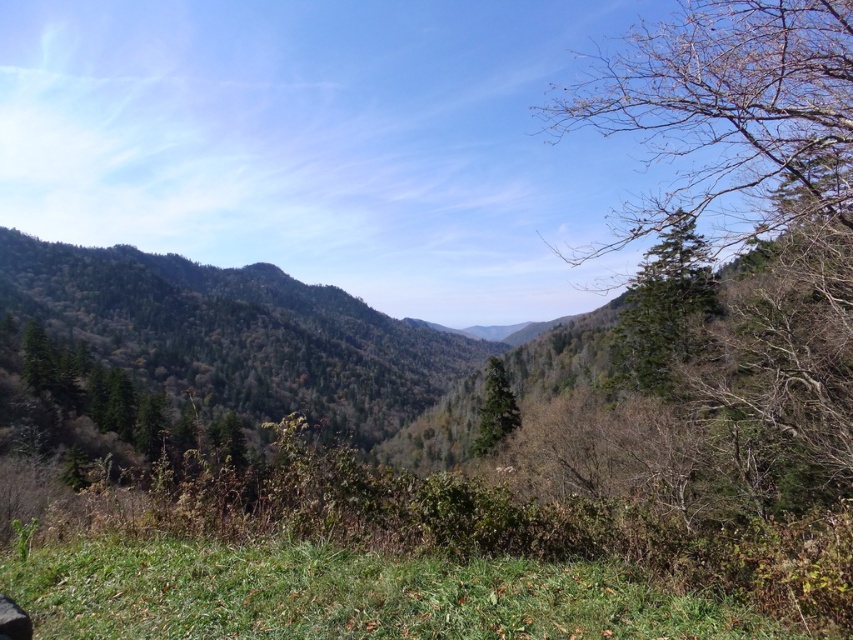
Which of these two, bare branches at upper right or green matte tree at upper right, stands shorter?

Standing shorter between the two is green matte tree at upper right.

Does bare branches at upper right have a larger size compared to green matte tree at upper right?

Indeed, bare branches at upper right has a larger size compared to green matte tree at upper right.

Who is more forward, (810, 145) or (704, 244)?

Point (810, 145) is in front.

At what (x,y) coordinates should I click in order to perform the action: click on bare branches at upper right. Please return your answer as a coordinate pair (x, y). The height and width of the screenshot is (640, 853). Looking at the image, I should click on (729, 113).

What are the coordinates of `green matte tree at upper right` in the screenshot? It's located at (664, 308).

Is point (695, 321) farther from viewer compared to point (508, 429)?

No, (695, 321) is closer to viewer.

Describe the element at coordinates (664, 308) in the screenshot. This screenshot has height=640, width=853. I see `green matte tree at upper right` at that location.

The height and width of the screenshot is (640, 853). I want to click on green matte tree at upper right, so click(x=664, y=308).

Who is positioned more to the right, bare branches at upper right or green matte tree at center?

bare branches at upper right

The height and width of the screenshot is (640, 853). I want to click on bare branches at upper right, so click(729, 113).

Where is `bare branches at upper right`? The width and height of the screenshot is (853, 640). bare branches at upper right is located at coordinates (729, 113).